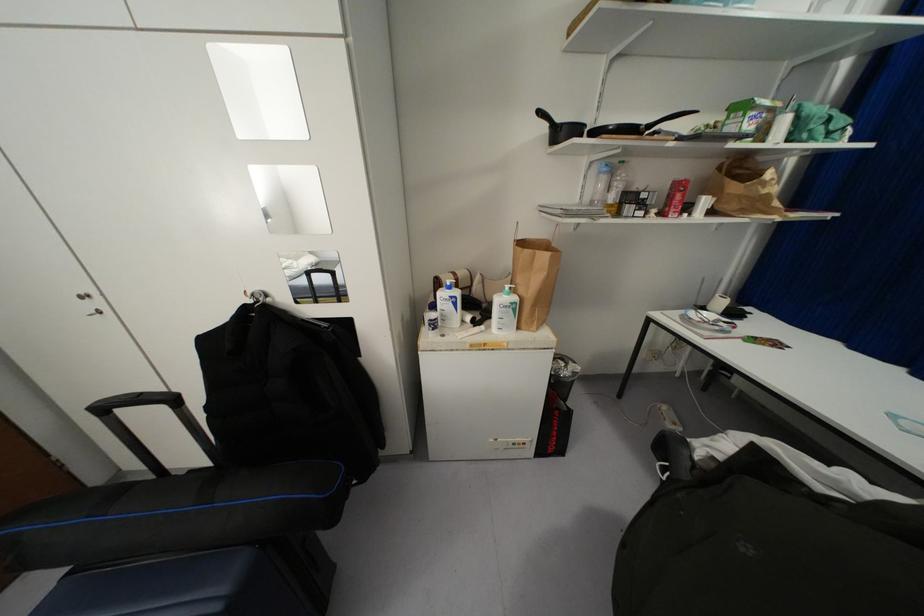
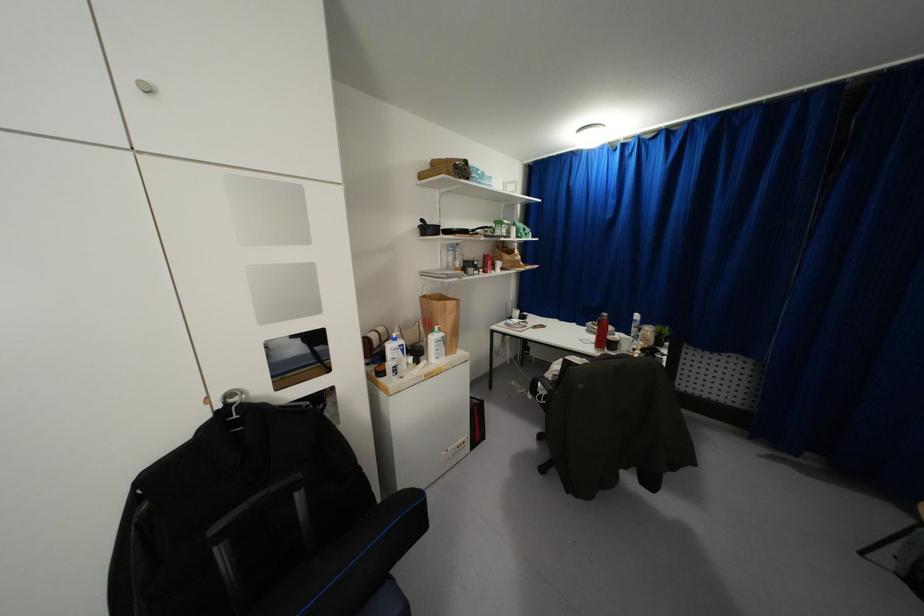
Where in the second image is the point corresponding to [515,298] from the first image?

(442, 333)